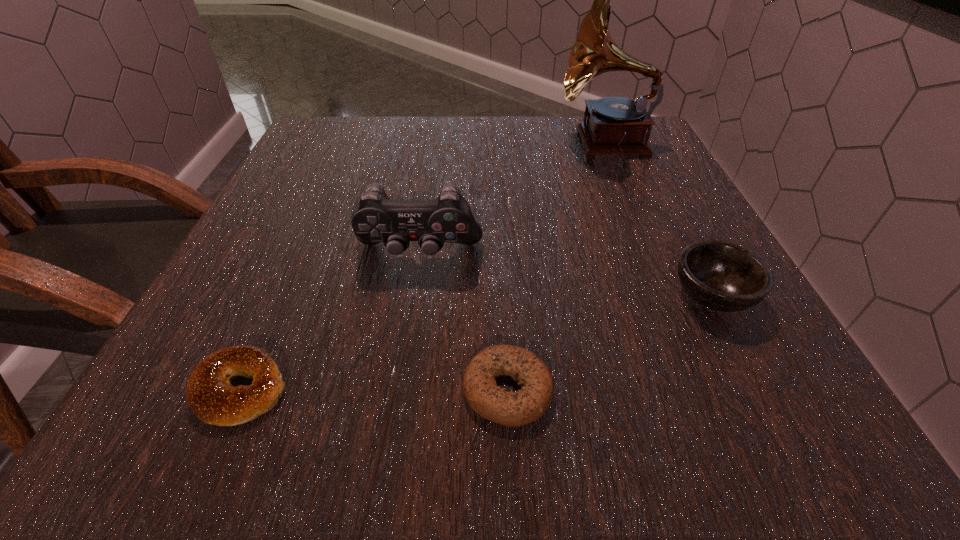
The image size is (960, 540). What are the coordinates of `vacant position in the image that satisfies the following two spatial constraints: 1. on the surface of the second tallest object with buttons; 2. on the left side of the bowl` in the screenshot? It's located at (412, 295).

Find the location of `vacant position in the image that satisfies the following two spatial constraints: 1. on the surface of the bowl with buttons; 2. on the right side of the fourth shortest object`. vacant position in the image that satisfies the following two spatial constraints: 1. on the surface of the bowl with buttons; 2. on the right side of the fourth shortest object is located at coordinates (412, 295).

I want to click on vacant space that satisfies the following two spatial constraints: 1. on the back side of the bowl; 2. on the horn of the farthest object, so click(x=632, y=141).